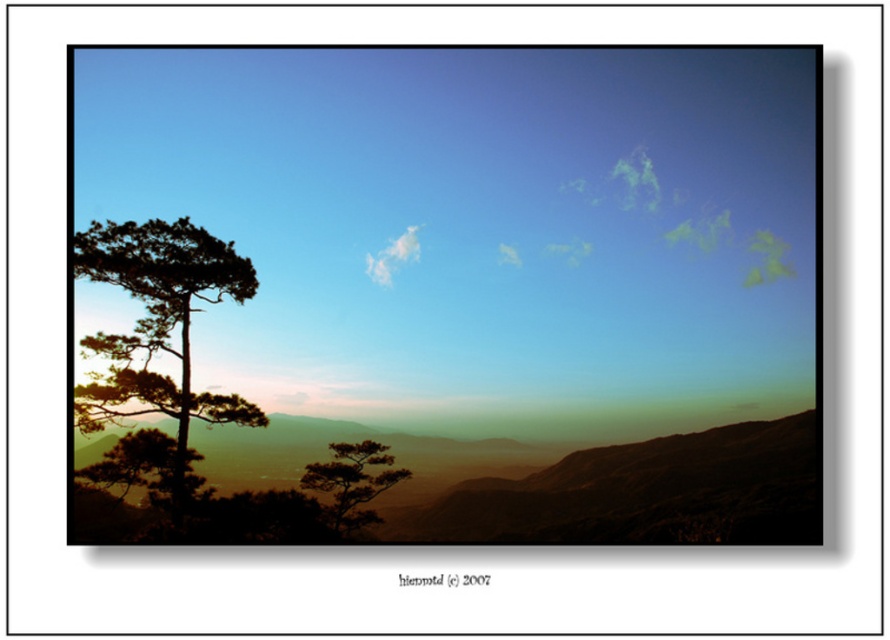
Question: Which point is closer to the camera?

Choices:
 (A) white fluffy cloud at upper center
 (B) silhouette pine tree at left
 (C) silvery metallic tree at center
 (D) silhouette wood tree at left

Answer: (D)

Question: Considering the real-world distances, which object is closest to the silhouette pine tree at left?

Choices:
 (A) silhouette wood tree at left
 (B) white fluffy cloud at upper center

Answer: (A)

Question: Which of the following is the farthest from the observer?

Choices:
 (A) (147, 452)
 (B) (407, 232)

Answer: (B)

Question: Does silhouette wood tree at left lie in front of silvery metallic tree at center?

Choices:
 (A) yes
 (B) no

Answer: (A)

Question: Is silhouette wood tree at left bigger than silhouette pine tree at left?

Choices:
 (A) no
 (B) yes

Answer: (B)

Question: Considering the relative positions of silhouette wood tree at left and silvery metallic tree at center in the image provided, where is silhouette wood tree at left located with respect to silvery metallic tree at center?

Choices:
 (A) left
 (B) right

Answer: (A)